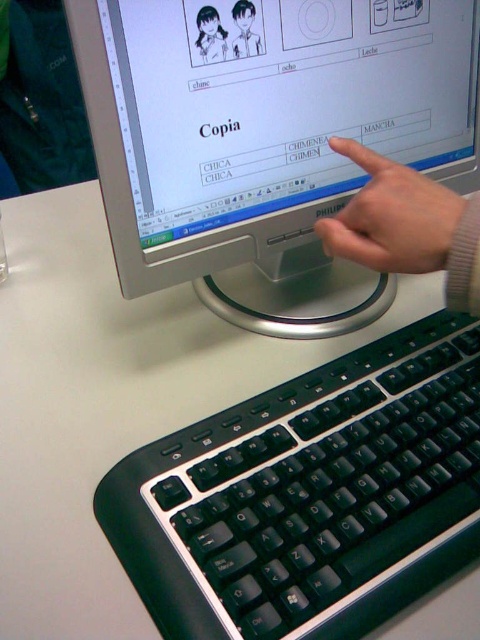
From the picture: You are a user trying to click on the table data on the monitor. The cursor is currently at point [478,170]. To reach the table data, you need to move the cursor to point [385,252]. Which direction should you move the cursor?

Since point [478,170] is behind point [385,252], you should move the cursor forward to reach the table data.